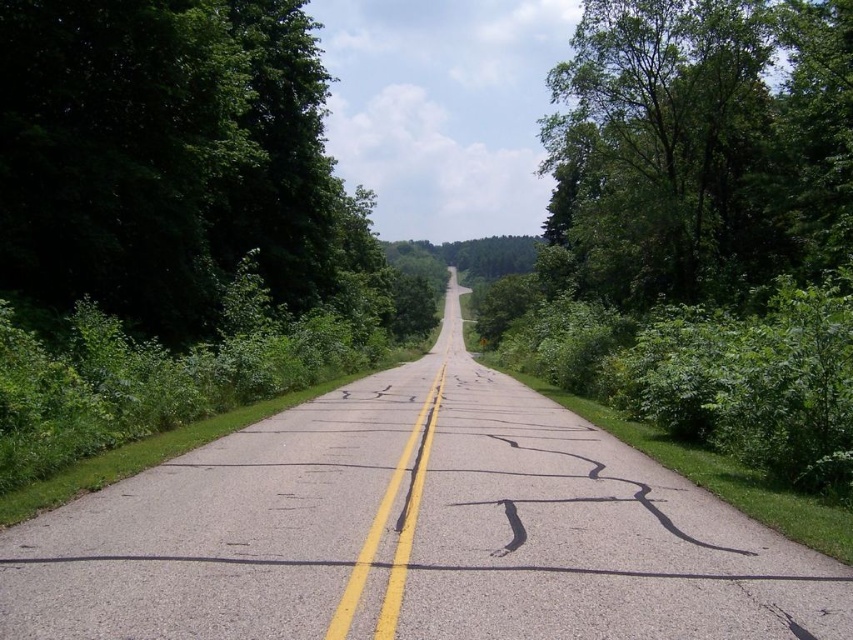
Question: Among these objects, which one is nearest to the camera?

Choices:
 (A) green leafy tree at upper right
 (B) green leafy tree at left

Answer: (B)

Question: Does green leafy tree at left come behind green leafy tree at upper right?

Choices:
 (A) no
 (B) yes

Answer: (A)

Question: Where is green leafy tree at left located in relation to green leafy tree at upper right in the image?

Choices:
 (A) right
 (B) left

Answer: (B)

Question: Among these objects, which one is nearest to the camera?

Choices:
 (A) green leafy tree at left
 (B) green leafy tree at upper right

Answer: (A)

Question: Can you confirm if green leafy tree at left is bigger than green leafy tree at upper right?

Choices:
 (A) no
 (B) yes

Answer: (A)